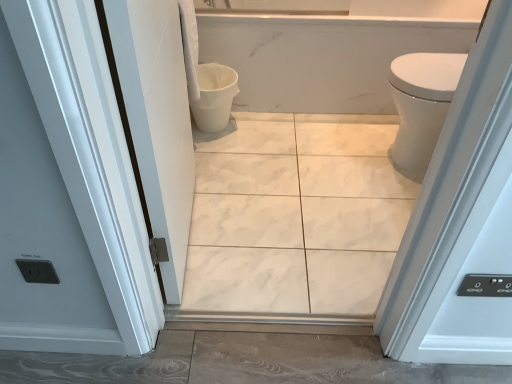
This screenshot has height=384, width=512. I want to click on vacant space in between white glossy door at left and white glossy bidet at right, so click(283, 201).